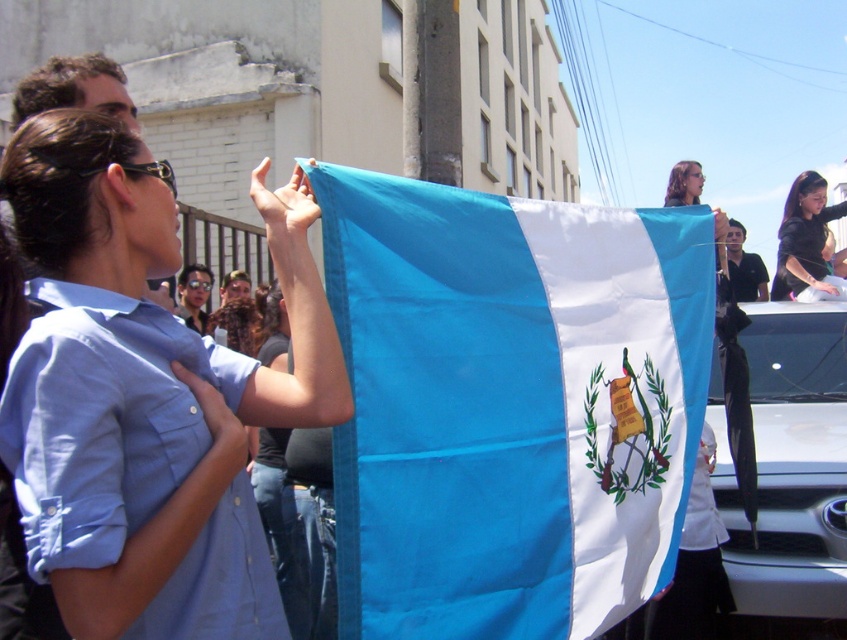
Question: Can you confirm if silky blue flag at center is smaller than white glossy car at lower right?

Choices:
 (A) no
 (B) yes

Answer: (B)

Question: Observing the image, what is the correct spatial positioning of blue fabric flag at upper center in reference to black glossy hair at upper right?

Choices:
 (A) right
 (B) left

Answer: (B)

Question: Which point appears farthest from the camera in this image?

Choices:
 (A) (817, 196)
 (B) (743, 513)
 (C) (547, 227)

Answer: (A)

Question: Which object is the closest to the white glossy car at lower right?

Choices:
 (A) blue fabric flag at upper center
 (B) black glossy hair at upper right

Answer: (B)

Question: Is silky blue flag at center thinner than blue fabric flag at upper center?

Choices:
 (A) no
 (B) yes

Answer: (A)

Question: Which point is closer to the camera taking this photo?

Choices:
 (A) (414, 337)
 (B) (810, 589)
 (C) (840, 298)

Answer: (A)